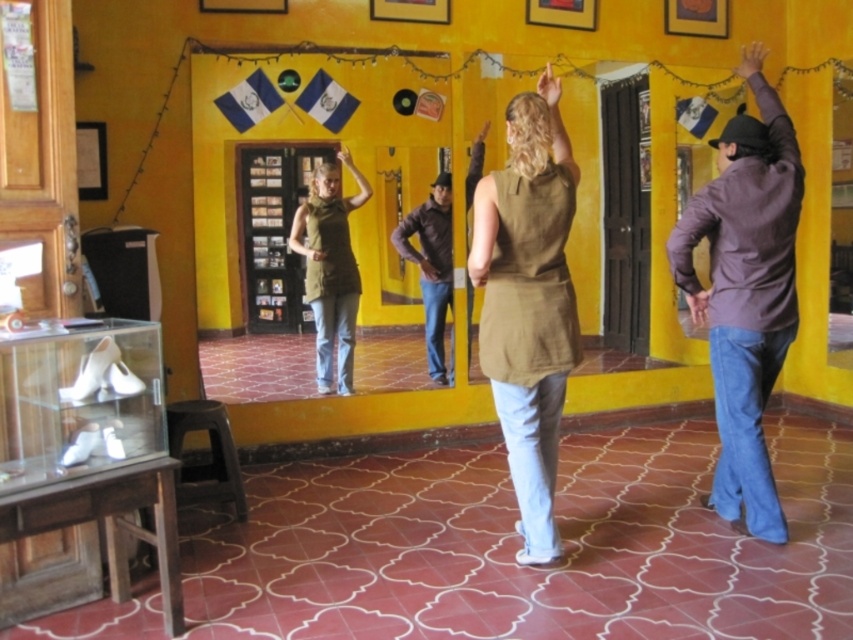
Can you confirm if dark purple jacket at upper right is thinner than green matte vest at center?

No, dark purple jacket at upper right is not thinner than green matte vest at center.

Is dark purple jacket at upper right smaller than green matte vest at center?

Correct, dark purple jacket at upper right occupies less space than green matte vest at center.

What do you see at coordinates (746, 292) in the screenshot? This screenshot has height=640, width=853. I see `dark purple jacket at upper right` at bounding box center [746, 292].

What are the coordinates of `dark purple jacket at upper right` in the screenshot? It's located at (746, 292).

Can you confirm if dark purple jacket at upper right is taller than matte olive-green vest at center?

Yes, dark purple jacket at upper right is taller than matte olive-green vest at center.

In the scene shown: Is dark purple jacket at upper right above matte olive-green vest at center?

Yes.

I want to click on dark purple jacket at upper right, so click(x=746, y=292).

Is green matte vest at center bigger than dark brown leather jacket at center?

Yes.

Who is lower down, green matte vest at center or dark brown leather jacket at center?

dark brown leather jacket at center

Describe the element at coordinates (329, 268) in the screenshot. I see `green matte vest at center` at that location.

You are a GUI agent. You are given a task and a screenshot of the screen. Output one action in this format:
    pyautogui.click(x=<x>, y=<y>)
    Task: Click on the green matte vest at center
    Image resolution: width=853 pixels, height=640 pixels.
    Given the screenshot: What is the action you would take?
    pyautogui.click(x=329, y=268)